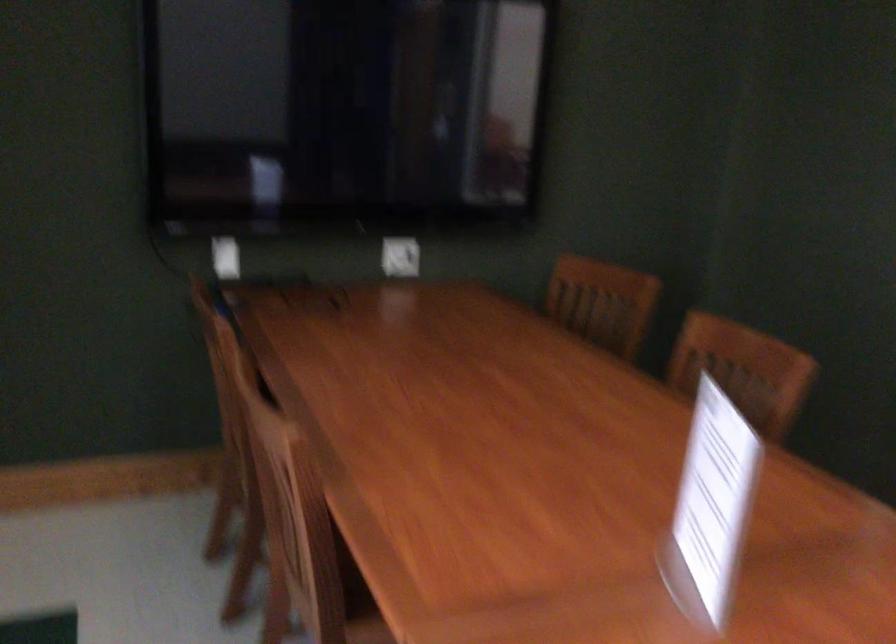
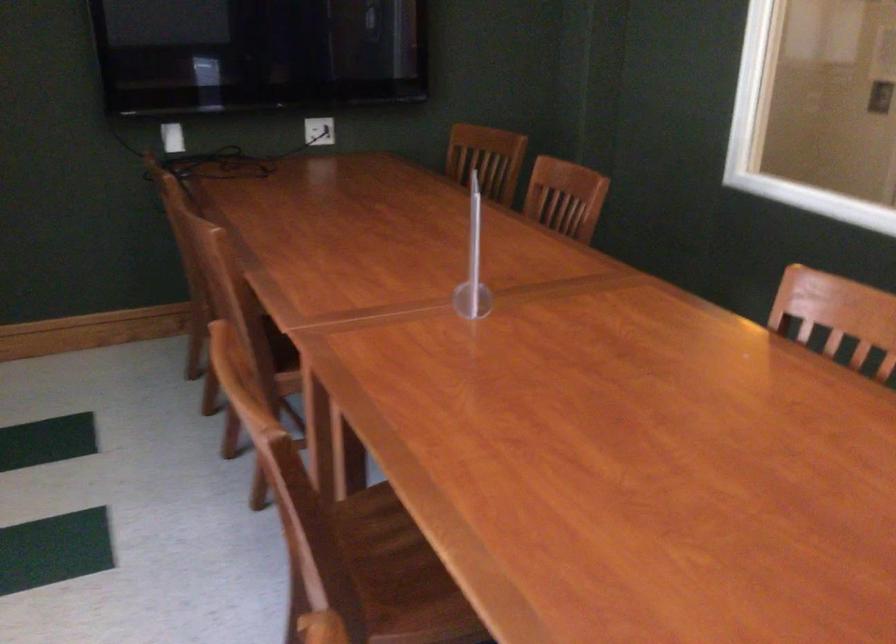
Where in the second image is the point corresponding to pixel 288 444 from the first image?

(216, 242)